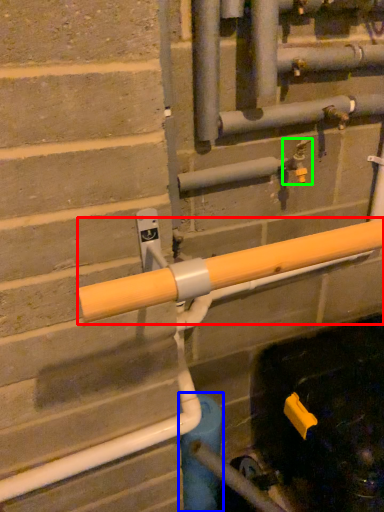
Question: Which is farther away from beam (highlighted by a red box)? water pipe (highlighted by a blue box) or plumbing fixture (highlighted by a green box)?

Choices:
 (A) water pipe
 (B) plumbing fixture

Answer: (A)